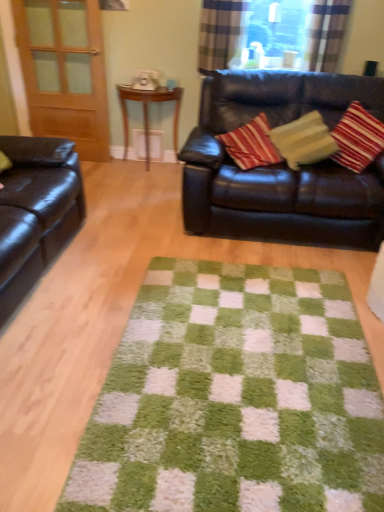
What is the approximate height of matte wood screen door at left?

matte wood screen door at left is 4.52 feet in height.

Where is `shiny black leather couch at upper right, the second studio couch in the left-to-right sequence`? The image size is (384, 512). shiny black leather couch at upper right, the second studio couch in the left-to-right sequence is located at coordinates (281, 165).

What do you see at coordinates (220, 33) in the screenshot? Image resolution: width=384 pixels, height=512 pixels. I see `plaid fabric curtain at upper right, the 2th curtain from the right` at bounding box center [220, 33].

Locate an element on the screen. This screenshot has height=512, width=384. plaid fabric curtain at upper right, the 2th curtain from the right is located at coordinates (220, 33).

Identify the location of transparent glass window at upper center. coord(277,32).

From the image's perspective, between shiny black leather couch at upper right, placed as the 1th studio couch when sorted from right to left, and wooden side table at center, which one is located above?

wooden side table at center.

Can wooden side table at center be found inside shiny black leather couch at upper right, the second studio couch in the left-to-right sequence?

Actually, wooden side table at center is outside shiny black leather couch at upper right, the second studio couch in the left-to-right sequence.

Does point (329, 217) come closer to viewer compared to point (125, 96)?

Yes, point (329, 217) is in front of point (125, 96).

From a real-world perspective, is shiny black leather couch at upper right, placed as the 1th studio couch when sorted from right to left, on wooden side table at center?

Indeed, from a real-world perspective, shiny black leather couch at upper right, placed as the 1th studio couch when sorted from right to left, stands above wooden side table at center.

Considering the positions of objects transparent glass window at upper center and plaid fabric curtain at upper center, the second curtain in the left-to-right sequence, in the image provided, who is more to the left, transparent glass window at upper center or plaid fabric curtain at upper center, the second curtain in the left-to-right sequence,?

transparent glass window at upper center.

Is transparent glass window at upper center next to plaid fabric curtain at upper center, the 1th curtain when ordered from right to left?

transparent glass window at upper center is not next to plaid fabric curtain at upper center, the 1th curtain when ordered from right to left, and they're not touching.

Where is `curtain above the transparent glass window at upper center (from a real-world perspective)`? This screenshot has height=512, width=384. curtain above the transparent glass window at upper center (from a real-world perspective) is located at coordinates (326, 33).

Between transparent glass window at upper center and plaid fabric curtain at upper center, the second curtain in the left-to-right sequence, which one has smaller width?

plaid fabric curtain at upper center, the second curtain in the left-to-right sequence.

Is point (317, 9) in front of point (358, 88)?

That is False.

Image resolution: width=384 pixels, height=512 pixels. Find the location of `the 1st curtain behind the shiny black leather couch at upper right, the second studio couch in the left-to-right sequence, starting your count from the anchor`. the 1st curtain behind the shiny black leather couch at upper right, the second studio couch in the left-to-right sequence, starting your count from the anchor is located at coordinates (326, 33).

Between plaid fabric curtain at upper center, the 1th curtain when ordered from right to left, and shiny black leather couch at upper right, the second studio couch in the left-to-right sequence, which one has more height?

Standing taller between the two is shiny black leather couch at upper right, the second studio couch in the left-to-right sequence.

Is plaid fabric curtain at upper center, the 1th curtain when ordered from right to left, not within shiny black leather couch at upper right, placed as the 1th studio couch when sorted from right to left?

Yes.

Is matte wood screen door at left facing towards plaid fabric curtain at upper center, the second curtain in the left-to-right sequence?

No, matte wood screen door at left is not aimed at plaid fabric curtain at upper center, the second curtain in the left-to-right sequence.

Is matte wood screen door at left located outside plaid fabric curtain at upper center, the second curtain in the left-to-right sequence?

Yes, matte wood screen door at left is located beyond the bounds of plaid fabric curtain at upper center, the second curtain in the left-to-right sequence.

In terms of size, does matte wood screen door at left appear bigger or smaller than plaid fabric curtain at upper center, the 1th curtain when ordered from right to left?

Clearly, matte wood screen door at left is larger in size than plaid fabric curtain at upper center, the 1th curtain when ordered from right to left.

From the image's perspective, is matte wood screen door at left above plaid fabric curtain at upper center, the second curtain in the left-to-right sequence?

No, from the image's perspective, matte wood screen door at left is not above plaid fabric curtain at upper center, the second curtain in the left-to-right sequence.

Is plaid fabric curtain at upper right, the 2th curtain from the right, facing towards shiny brown leather couch at left, the first studio couch positioned from the left?

No, plaid fabric curtain at upper right, the 2th curtain from the right, is not aimed at shiny brown leather couch at left, the first studio couch positioned from the left.

Does plaid fabric curtain at upper right, which appears as the 1th curtain when viewed from the left, have a smaller size compared to shiny brown leather couch at left, acting as the second studio couch starting from the right?

Correct, plaid fabric curtain at upper right, which appears as the 1th curtain when viewed from the left, occupies less space than shiny brown leather couch at left, acting as the second studio couch starting from the right.

Is plaid fabric curtain at upper right, the 2th curtain from the right, next to shiny brown leather couch at left, acting as the second studio couch starting from the right, and touching it?

No.

From the image's perspective, which one is positioned lower, plaid fabric curtain at upper right, which appears as the 1th curtain when viewed from the left, or shiny brown leather couch at left, the first studio couch positioned from the left?

shiny brown leather couch at left, the first studio couch positioned from the left, is shown below in the image.

From a real-world perspective, is wooden side table at center under white matte square at center?

Actually, wooden side table at center is physically above white matte square at center in the real world.

Is wooden side table at center located outside white matte square at center?

Absolutely, wooden side table at center is external to white matte square at center.

From the image's perspective, is wooden side table at center on white matte square at center?

Yes, from the image's perspective, wooden side table at center is above white matte square at center.

Which is more to the left, wooden side table at center or white matte square at center?

white matte square at center is more to the left.

Is green shaggy rug at center at the back of white matte square at center?

No.

In terms of height, does white matte square at center look taller or shorter compared to green shaggy rug at center?

Clearly, white matte square at center is taller compared to green shaggy rug at center.

Does point (143, 135) appear closer or farther from the camera than point (225, 438)?

Clearly, point (143, 135) is more distant from the camera than point (225, 438).

Identify the location of table that appears behind the shiny black leather couch at upper right, the second studio couch in the left-to-right sequence. This screenshot has height=512, width=384. (148, 114).

The height and width of the screenshot is (512, 384). In the image, there is a plaid fabric curtain at upper center, the 1th curtain when ordered from right to left. Identify the location of window screen below it (from a real-world perspective). (277, 32).

From the image, which object appears to be farther from plaid fabric curtain at upper right, which appears as the 1th curtain when viewed from the left, wooden side table at center or transparent glass window at upper center?

The object further to plaid fabric curtain at upper right, which appears as the 1th curtain when viewed from the left, is wooden side table at center.

Which object lies further to the anchor point green shaggy rug at center, shiny black leather couch at upper right, the second studio couch in the left-to-right sequence, or white matte square at center?

white matte square at center is positioned further to the anchor green shaggy rug at center.

Looking at the image, which one is located further to white matte square at center, wooden side table at center or matte wood screen door at left?

matte wood screen door at left is further to white matte square at center.

Which object lies further to the anchor point plaid fabric curtain at upper center, the 1th curtain when ordered from right to left, shiny black leather couch at upper right, the second studio couch in the left-to-right sequence, or plaid fabric curtain at upper right, the 2th curtain from the right?

Among the two, shiny black leather couch at upper right, the second studio couch in the left-to-right sequence, is located further to plaid fabric curtain at upper center, the 1th curtain when ordered from right to left.

Looking at the image, which one is located further to green shaggy rug at center, shiny brown leather couch at left, the first studio couch positioned from the left, or wooden side table at center?

wooden side table at center lies further to green shaggy rug at center than the other object.

When comparing their distances from wooden side table at center, does green shaggy rug at center or white matte square at center seem closer?

white matte square at center is closer to wooden side table at center.

Based on their spatial positions, is plaid fabric curtain at upper center, the 1th curtain when ordered from right to left, or plaid fabric curtain at upper right, which appears as the 1th curtain when viewed from the left, further from transparent glass window at upper center?

Among the two, plaid fabric curtain at upper right, which appears as the 1th curtain when viewed from the left, is located further to transparent glass window at upper center.

Based on their spatial positions, is matte wood screen door at left or green shaggy rug at center closer to shiny black leather couch at upper right, placed as the 1th studio couch when sorted from right to left?

Among the two, green shaggy rug at center is located nearer to shiny black leather couch at upper right, placed as the 1th studio couch when sorted from right to left.

Image resolution: width=384 pixels, height=512 pixels. In order to click on studio couch between matte wood screen door at left and shiny black leather couch at upper right, the second studio couch in the left-to-right sequence, in the horizontal direction in this screenshot , I will do `click(36, 211)`.

At what (x,y) coordinates should I click in order to perform the action: click on screen door between green shaggy rug at center and white matte square at center in the front-back direction. Please return your answer as a coordinate pair (x, y). Looking at the image, I should click on (65, 72).

This screenshot has width=384, height=512. I want to click on window screen situated between plaid fabric curtain at upper right, which appears as the 1th curtain when viewed from the left, and plaid fabric curtain at upper center, the 1th curtain when ordered from right to left, from left to right, so click(277, 32).

I want to click on studio couch located between shiny brown leather couch at left, acting as the second studio couch starting from the right, and plaid fabric curtain at upper center, the second curtain in the left-to-right sequence, in the left-right direction, so click(x=281, y=165).